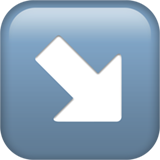
Find the location of a particular element. box is located at coordinates (84, 125).